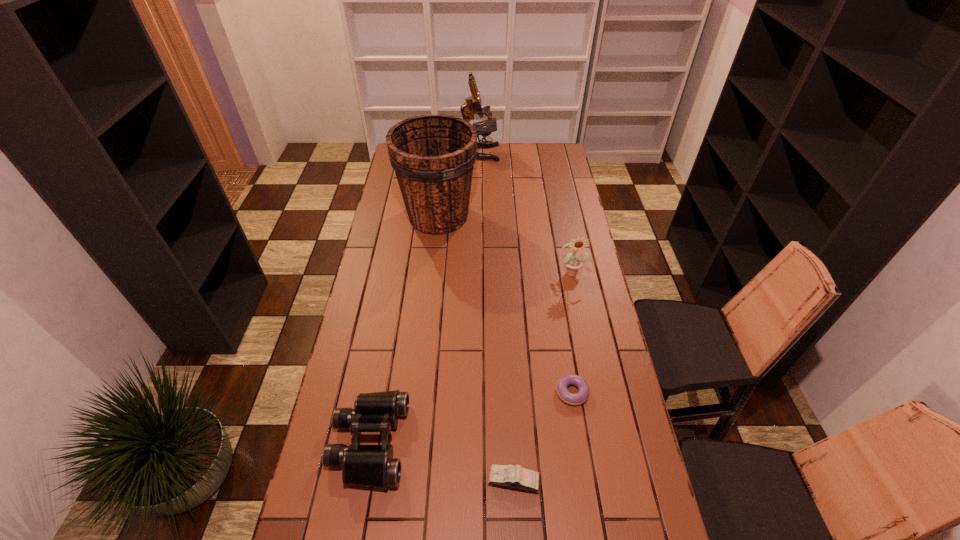
Point out which object is positioned as the third nearest to the diary. Please provide its 2D coordinates. Your answer should be formatted as a tuple, i.e. [(x, y)], where the tuple contains the x and y coordinates of a point satisfying the conditions above.

[(573, 264)]

Locate which object ranks second in proximity to the binoculars. Please provide its 2D coordinates. Your answer should be formatted as a tuple, i.e. [(x, y)], where the tuple contains the x and y coordinates of a point satisfying the conditions above.

[(581, 396)]

Image resolution: width=960 pixels, height=540 pixels. Identify the location of free spot that satisfies the following two spatial constraints: 1. at the eyepieces of the doughnut; 2. on the left side of the microscope. (479, 392).

The height and width of the screenshot is (540, 960). In order to click on free spot that satisfies the following two spatial constraints: 1. on the front side of the doughnut; 2. on the right side of the second farthest object in this screenshot , I will do `click(420, 392)`.

At what (x,y) coordinates should I click in order to perform the action: click on free point that satisfies the following two spatial constraints: 1. at the eyepieces of the doughnut; 2. on the right side of the microscope. Please return your answer as a coordinate pair (x, y). The height and width of the screenshot is (540, 960). Looking at the image, I should click on (479, 392).